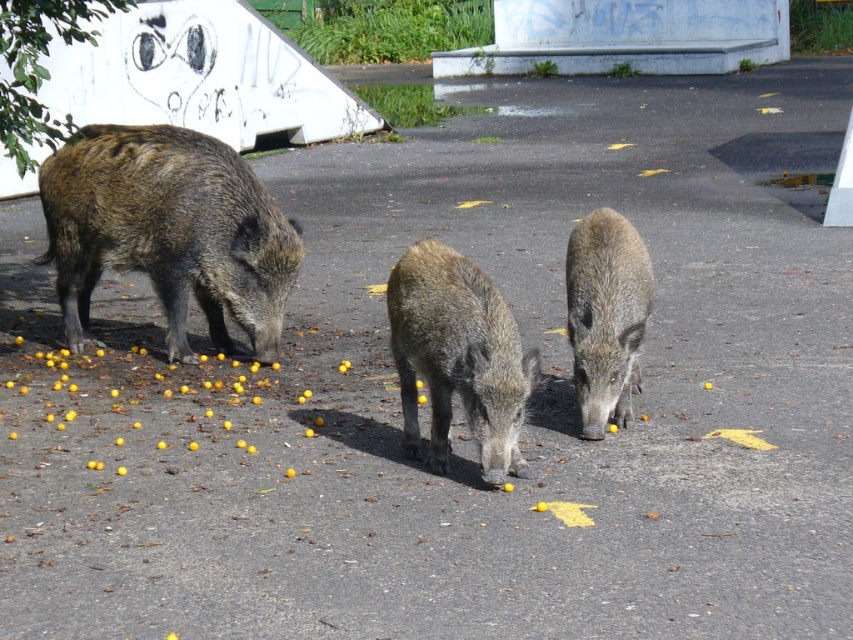
In the scene shown: You are a wildlife photographer trying to capture a photo of the brown rough skin pig at center and the brown rough textured pig at center. Which one should you focus on first if you want to photograph them from top to bottom?

You should focus on the brown rough textured pig at center first because it is located above the brown rough skin pig at center.

Based on the photo, you are a wildlife photographer aiming to capture the tallest pig in the scene. Given that you see both the brown rough skin pig at center and the brown rough textured pig at center, which one should you focus on?

The brown rough textured pig at center is taller than the brown rough skin pig at center, so you should focus on the brown rough textured pig at center to capture the tallest pig.

In the image, there are two wild boars feeding on yellow objects. The brown textured pig at left and the brown rough textured pig at center. Which one is taller?

The brown textured pig at left is taller than the brown rough textured pig at center.